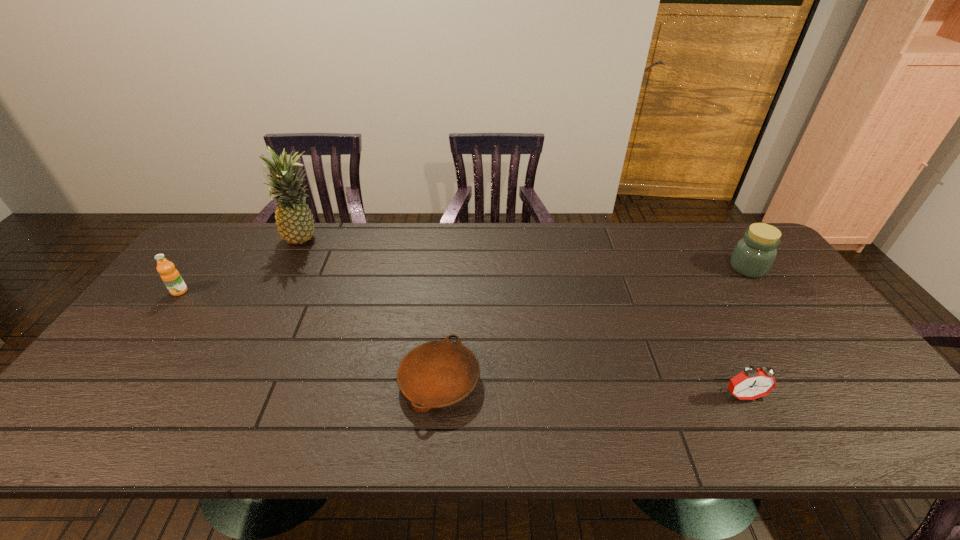
Image resolution: width=960 pixels, height=540 pixels. What are the coordinates of `object present at the far right corner` in the screenshot? It's located at (753, 256).

At what (x,y) coordinates should I click in order to perform the action: click on free location at the far edge. Please return your answer as a coordinate pair (x, y). Image resolution: width=960 pixels, height=540 pixels. Looking at the image, I should click on (470, 242).

In the image, there is a desktop. What are the coordinates of `free region at the near edge` in the screenshot? It's located at (532, 419).

In the image, there is a desktop. At what (x,y) coordinates should I click in order to perform the action: click on free space at the left edge. Please return your answer as a coordinate pair (x, y). Looking at the image, I should click on (196, 287).

Find the location of a particular element. The height and width of the screenshot is (540, 960). free space at the far left corner of the desktop is located at coordinates (213, 260).

Image resolution: width=960 pixels, height=540 pixels. I want to click on free space that is in between the fourth object from right to left and the orange juice, so click(242, 266).

The width and height of the screenshot is (960, 540). Find the location of `free space between the alarm clock and the shortest object`. free space between the alarm clock and the shortest object is located at coordinates (591, 388).

Find the location of a particular element. The height and width of the screenshot is (540, 960). vacant area that lies between the third object from right to left and the rightmost object is located at coordinates (593, 325).

The height and width of the screenshot is (540, 960). Find the location of `free space between the tallest object and the plate`. free space between the tallest object and the plate is located at coordinates (372, 310).

The height and width of the screenshot is (540, 960). In order to click on free spot between the plate and the farthest object in this screenshot , I will do `click(372, 310)`.